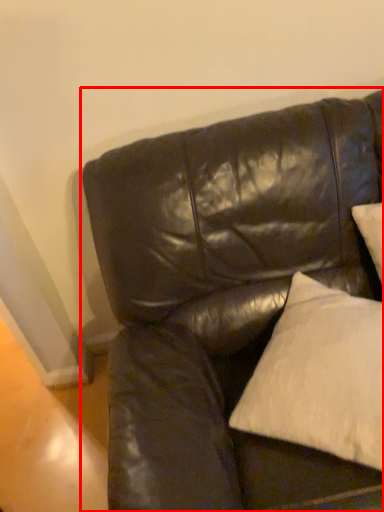
Question: From the image's perspective, where is studio couch (annotated by the red box) located in relation to pillow in the image?

Choices:
 (A) below
 (B) above

Answer: (A)